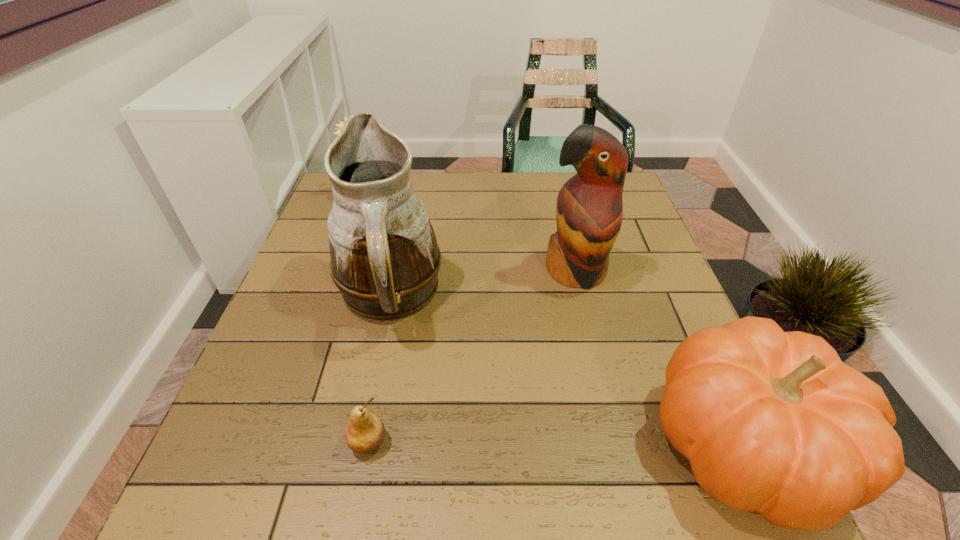
Where is `vacant point at the far edge`? vacant point at the far edge is located at coordinates (541, 193).

Where is `vacant space at the near edge of the desktop`? The height and width of the screenshot is (540, 960). vacant space at the near edge of the desktop is located at coordinates [x=376, y=404].

In the image, there is a desktop. Where is `vacant area at the left edge`? vacant area at the left edge is located at coordinates (306, 348).

Where is `vacant area at the right edge of the desktop`? The image size is (960, 540). vacant area at the right edge of the desktop is located at coordinates (629, 232).

Where is `free point at the far right corner`? The width and height of the screenshot is (960, 540). free point at the far right corner is located at coordinates [631, 200].

This screenshot has width=960, height=540. I want to click on vacant point located between the sunflower and the shortest object, so click(367, 319).

Where is `free spot between the parrot and the sunflower`? free spot between the parrot and the sunflower is located at coordinates (469, 233).

Where is `free space that is in between the parrot and the farthest object`? This screenshot has width=960, height=540. free space that is in between the parrot and the farthest object is located at coordinates (469, 233).

Identify the location of vacant region between the sunflower and the shortest object. point(367,319).

You are a GUI agent. You are given a task and a screenshot of the screen. Output one action in this format:
    pyautogui.click(x=<x>, y=<y>)
    Task: Click on the free spot between the parrot and the sunflower
    Image resolution: width=960 pixels, height=540 pixels.
    Given the screenshot: What is the action you would take?
    pyautogui.click(x=469, y=233)